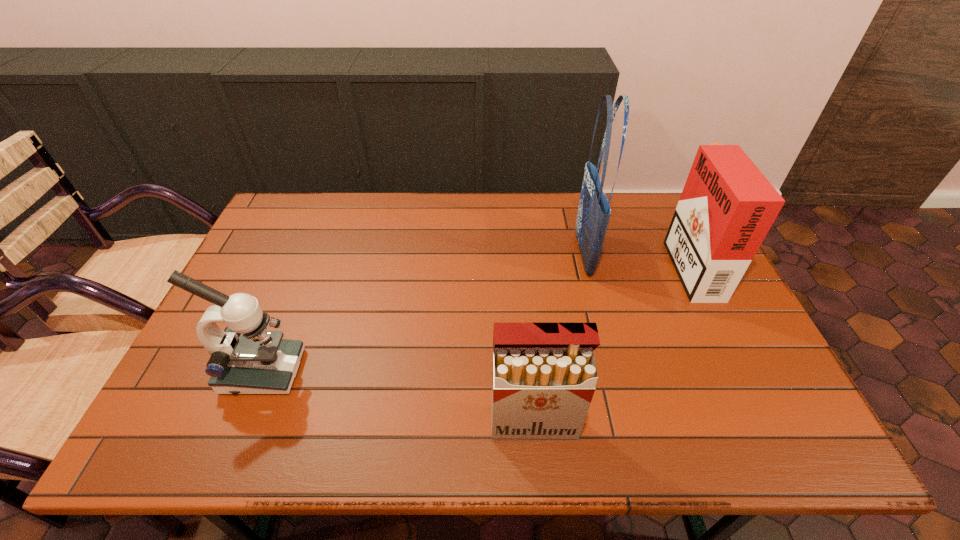
Locate an element on the screen. The height and width of the screenshot is (540, 960). vacant area situated 0.340m on the front-facing side of the third object from left to right is located at coordinates (466, 254).

Locate an element on the screen. The image size is (960, 540). vacant region located on the front-facing side of the rightmost object is located at coordinates (636, 264).

Where is `vacant space situated 0.260m on the front-facing side of the rightmost object`? This screenshot has width=960, height=540. vacant space situated 0.260m on the front-facing side of the rightmost object is located at coordinates (588, 264).

Identify the location of blank space located on the front-facing side of the rightmost object. (590, 264).

The height and width of the screenshot is (540, 960). In order to click on free space located at the eyepiece of the microscope in this screenshot , I will do `click(365, 372)`.

The height and width of the screenshot is (540, 960). I want to click on shopping bag situated at the far edge, so click(x=594, y=211).

Image resolution: width=960 pixels, height=540 pixels. In order to click on cigarette case located in the far edge section of the desktop in this screenshot , I will do `click(727, 206)`.

At what (x,y) coordinates should I click in order to perform the action: click on object that is at the near edge. Please return your answer as a coordinate pair (x, y). Looking at the image, I should click on (544, 374).

At what (x,y) coordinates should I click in order to perform the action: click on object positioned at the left edge. Please return your answer as a coordinate pair (x, y). The height and width of the screenshot is (540, 960). Looking at the image, I should click on (245, 358).

Locate an element on the screen. The image size is (960, 540). object present at the right edge is located at coordinates (727, 206).